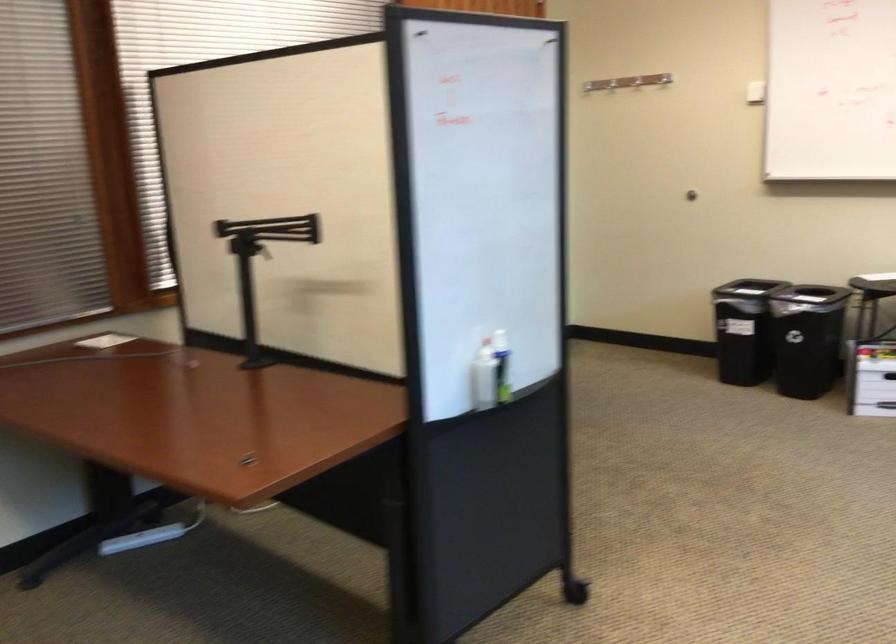
Image resolution: width=896 pixels, height=644 pixels. What are the coordinates of `white file box` in the screenshot? It's located at (871, 379).